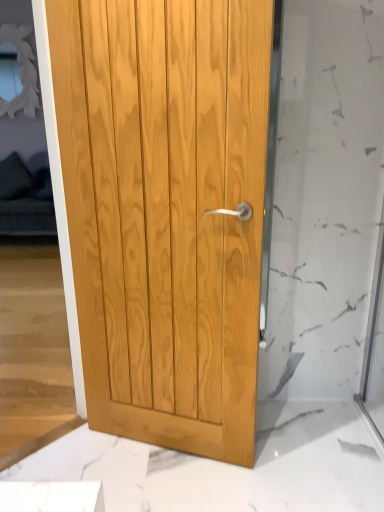
Describe the element at coordinates (166, 211) in the screenshot. I see `light wood panel door at center` at that location.

At what (x,y) coordinates should I click in order to perform the action: click on light wood panel door at center. Please return your answer as a coordinate pair (x, y). This screenshot has width=384, height=512. Looking at the image, I should click on (166, 211).

In order to face light wood panel door at center, should I rotate leftwards or rightwards?

To align with it, rotate left about 4.079°.

Where is `light wood panel door at center`? The width and height of the screenshot is (384, 512). light wood panel door at center is located at coordinates (166, 211).